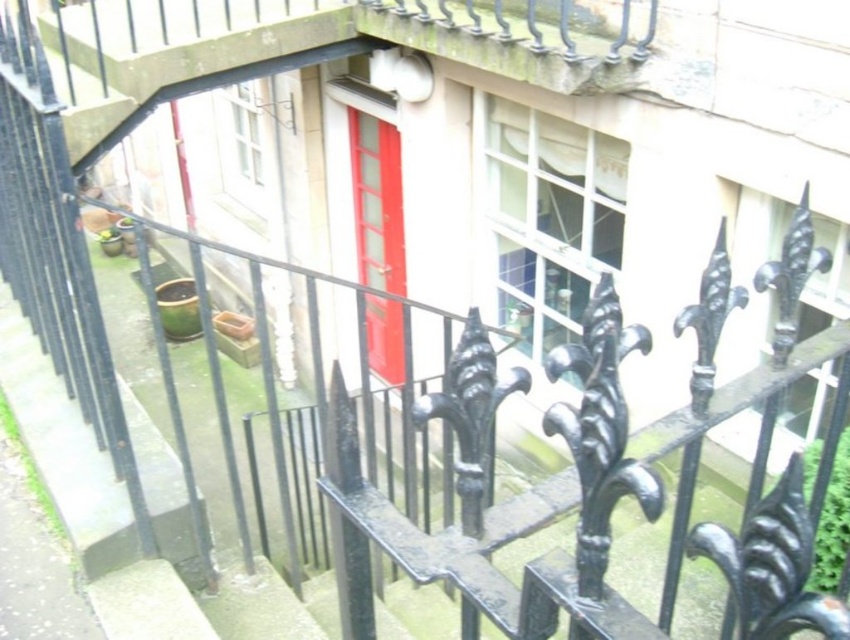
You are standing on the smooth concrete balcony at upper center and want to enter the matte red door at center. Which direction should you move to reach the door?

You should move to the right because the smooth concrete balcony at upper center is to the left of the matte red door at center, so moving right will bring you towards the door.

You are standing on the black wrought iron railing with decorative finials in the residential area. You see a point labeled as point (310, 48). What is the surface type of the location where this point is located?

The point (310, 48) is on smooth concrete balcony at upper center, so the surface type is smooth concrete.

You are standing on the smooth concrete balcony at upper center and want to reach the matte red door at center. Considering the height difference between the two, which direction should you move to get closer to the door?

The smooth concrete balcony at upper center has a lesser height compared to the matte red door at center, so you should move downward to get closer to the matte red door at center.